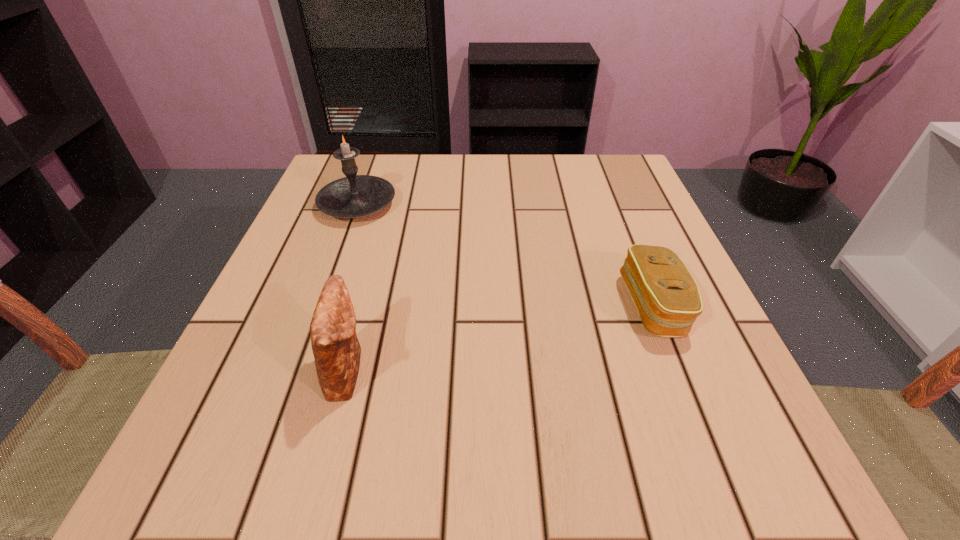
Image resolution: width=960 pixels, height=540 pixels. Identify the location of free spot between the second tallest object and the right clutch bag. (500, 338).

The height and width of the screenshot is (540, 960). In order to click on object that is the second closest to the farthest object in this screenshot , I will do pos(667,298).

Locate which object is the second closest to the right clutch bag. Please provide its 2D coordinates. Your answer should be formatted as a tuple, i.e. [(x, y)], where the tuple contains the x and y coordinates of a point satisfying the conditions above.

[(353, 196)]